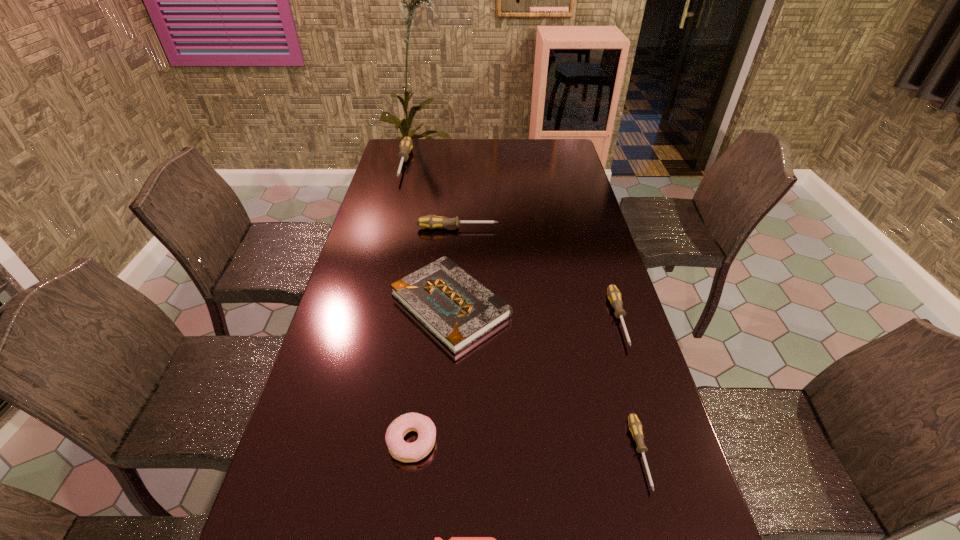
Identify which gray screwdriver is the second nearest to the sixth nearest object. Please provide its 2D coordinates. Your answer should be formatted as a tuple, i.e. [(x, y)], where the tuple contains the x and y coordinates of a point satisfying the conditions above.

[(614, 295)]